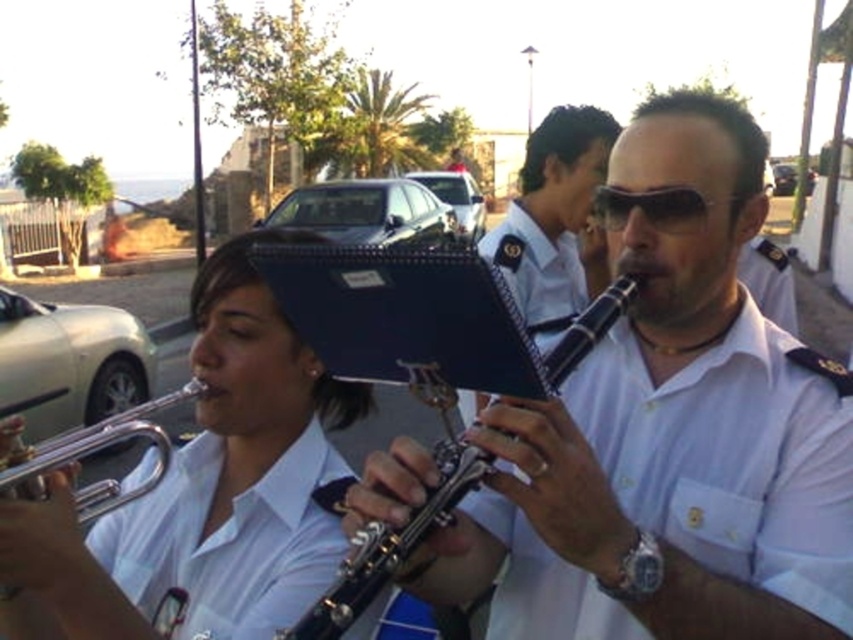
Is silver metallic trumpet at lower left bigger than sunglasses at center?

Indeed, silver metallic trumpet at lower left has a larger size compared to sunglasses at center.

Can you confirm if silver metallic trumpet at lower left is wider than sunglasses at center?

Yes.

Where is `silver metallic trumpet at lower left`? The image size is (853, 640). silver metallic trumpet at lower left is located at coordinates (97, 451).

Can you confirm if metallic silver clarinet at center is wider than sunglasses at center?

Correct, the width of metallic silver clarinet at center exceeds that of sunglasses at center.

Where is `metallic silver clarinet at center`? The image size is (853, 640). metallic silver clarinet at center is located at coordinates (387, 550).

Is white cotton shirt at center to the right of sunglasses at center from the viewer's perspective?

No, white cotton shirt at center is not to the right of sunglasses at center.

Is white cotton shirt at center closer to the viewer compared to sunglasses at center?

Yes, it is in front of sunglasses at center.

The image size is (853, 640). What do you see at coordinates (730, 456) in the screenshot?
I see `white cotton shirt at center` at bounding box center [730, 456].

Identify the location of white cotton shirt at center. The width and height of the screenshot is (853, 640). (730, 456).